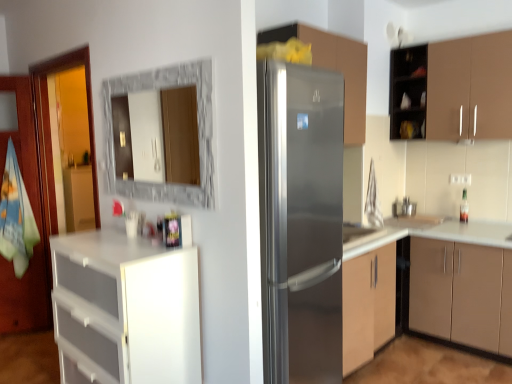
Identify the location of empty space that is ontop of marble frame mirror at upper center (from a real-world perspective). (168, 64).